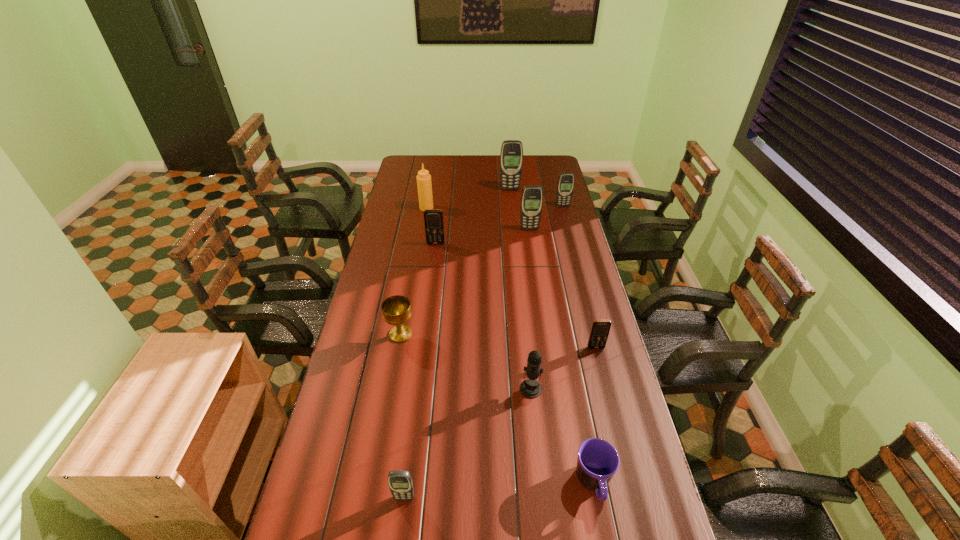
The image size is (960, 540). I want to click on black microphone, so click(530, 388).

At what (x,y) coordinates should I click in order to perform the action: click on chalice. Please return your answer as a coordinate pair (x, y). Image resolution: width=960 pixels, height=540 pixels. Looking at the image, I should click on (396, 310).

Locate an element on the screen. The height and width of the screenshot is (540, 960). the nearer orange cellular telephone is located at coordinates (600, 329).

Locate an element on the screen. the smaller orange cellular telephone is located at coordinates (600, 329).

You are a GUI agent. You are given a task and a screenshot of the screen. Output one action in this format:
    pyautogui.click(x=<x>, y=<y>)
    Task: Click on the nearest cellular telephone
    
    Given the screenshot: What is the action you would take?
    pyautogui.click(x=400, y=483)

At what (x,y) coordinates should I click in order to perform the action: click on the nearest gray cellular telephone. Please return your answer as a coordinate pair (x, y). This screenshot has height=540, width=960. Looking at the image, I should click on (400, 483).

The image size is (960, 540). I want to click on the shortest object, so click(598, 461).

Locate an element on the screen. The image size is (960, 540). black mug is located at coordinates (598, 461).

You are a GUI agent. You are given a task and a screenshot of the screen. Output one action in this format:
    pyautogui.click(x=<x>, y=<y>)
    Task: Click on the free spot located on the screen of the tallest cellular telephone
    This screenshot has height=540, width=960.
    Given the screenshot: What is the action you would take?
    pyautogui.click(x=515, y=235)

Find the location of a particular element. The width and height of the screenshot is (960, 540). vacant position located 0.320m on the right of the tan condiment is located at coordinates (497, 208).